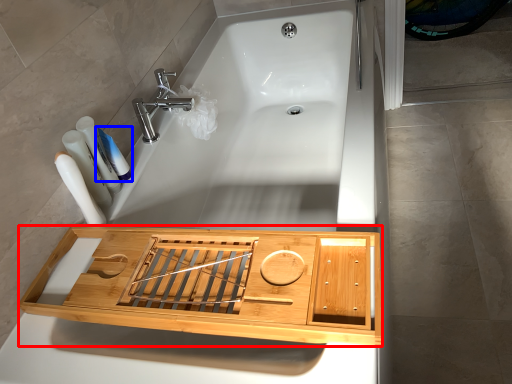
Question: Which object appears closest to the camera in this image, cabinetry (highlighted by a red box) or toothpaste (highlighted by a blue box)?

Choices:
 (A) cabinetry
 (B) toothpaste

Answer: (A)